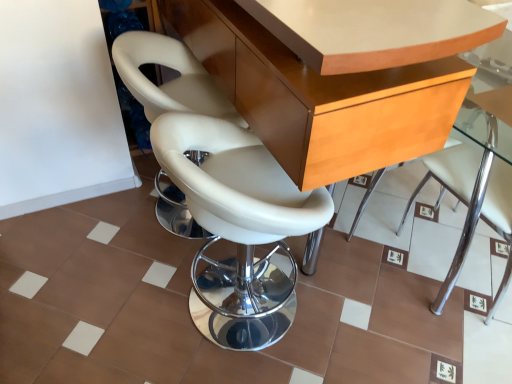
The height and width of the screenshot is (384, 512). Describe the element at coordinates (471, 205) in the screenshot. I see `white leather chair at center, which ranks as the 3th chair in left-to-right order` at that location.

Find the location of a particular element. white leather chair at center, the 2th chair in the left-to-right sequence is located at coordinates (238, 226).

From the image's perspective, is white leather chair at center, which ranks as the 3th chair in right-to-left order, above or below white leather chair at center, which ranks as the 3th chair in left-to-right order?

white leather chair at center, which ranks as the 3th chair in right-to-left order, is above white leather chair at center, which ranks as the 3th chair in left-to-right order.

Visually, is white leather chair at center, which is counted as the first chair, starting from the left, positioned to the left or to the right of white leather chair at center, which ranks as the 3th chair in left-to-right order?

Based on their positions, white leather chair at center, which is counted as the first chair, starting from the left, is located to the left of white leather chair at center, which ranks as the 3th chair in left-to-right order.

Does white leather chair at center, which is counted as the first chair, starting from the left, have a smaller size compared to white leather chair at center, which ranks as the 1th chair in right-to-left order?

Actually, white leather chair at center, which is counted as the first chair, starting from the left, might be larger than white leather chair at center, which ranks as the 1th chair in right-to-left order.

Identify the location of chair that is the 1st object located below the light brown wood table at center (from the image's perspective). The image size is (512, 384). (169, 81).

Which of these two, light brown wood table at center or white leather chair at center, which is counted as the first chair, starting from the left, stands shorter?

With less height is white leather chair at center, which is counted as the first chair, starting from the left.

From the picture: Considering the relative sizes of light brown wood table at center and white leather chair at center, which ranks as the 3th chair in right-to-left order, in the image provided, is light brown wood table at center bigger than white leather chair at center, which ranks as the 3th chair in right-to-left order,?

Correct, light brown wood table at center is larger in size than white leather chair at center, which ranks as the 3th chair in right-to-left order.

From the image's perspective, is light brown wood table at center on white leather chair at center, which ranks as the 3th chair in right-to-left order?

Correct, light brown wood table at center appears higher than white leather chair at center, which ranks as the 3th chair in right-to-left order, in the image.

Which is correct: light brown wood table at center is inside white leather chair at center, arranged as the 2th chair when viewed from the right, or outside of it?

The correct answer is: outside.

Considering the relative positions of light brown wood table at center and white leather chair at center, the 2th chair in the left-to-right sequence, in the image provided, is light brown wood table at center to the right of white leather chair at center, the 2th chair in the left-to-right sequence, from the viewer's perspective?

Indeed, light brown wood table at center is positioned on the right side of white leather chair at center, the 2th chair in the left-to-right sequence.

Which of these two, light brown wood table at center or white leather chair at center, the 2th chair in the left-to-right sequence, stands shorter?

white leather chair at center, the 2th chair in the left-to-right sequence, is shorter.

Is light brown wood table at center aimed at white leather chair at center, the 2th chair in the left-to-right sequence?

No, light brown wood table at center is not facing towards white leather chair at center, the 2th chair in the left-to-right sequence.

Measure the distance between white leather chair at center, arranged as the 2th chair when viewed from the right, and white leather chair at center, which ranks as the 3th chair in left-to-right order.

white leather chair at center, arranged as the 2th chair when viewed from the right, is 33.30 inches away from white leather chair at center, which ranks as the 3th chair in left-to-right order.

Considering the sizes of objects white leather chair at center, arranged as the 2th chair when viewed from the right, and white leather chair at center, which ranks as the 3th chair in left-to-right order, in the image provided, who is shorter, white leather chair at center, arranged as the 2th chair when viewed from the right, or white leather chair at center, which ranks as the 3th chair in left-to-right order,?

With less height is white leather chair at center, arranged as the 2th chair when viewed from the right.

Visually, is white leather chair at center, arranged as the 2th chair when viewed from the right, positioned to the left or to the right of white leather chair at center, which ranks as the 3th chair in left-to-right order?

Based on their positions, white leather chair at center, arranged as the 2th chair when viewed from the right, is located to the left of white leather chair at center, which ranks as the 3th chair in left-to-right order.

Are white leather chair at center, which is counted as the first chair, starting from the left, and white leather chair at center, arranged as the 2th chair when viewed from the right, located far from each other?

No, white leather chair at center, which is counted as the first chair, starting from the left, is in close proximity to white leather chair at center, arranged as the 2th chair when viewed from the right.

Is white leather chair at center, which is counted as the first chair, starting from the left, taller than white leather chair at center, arranged as the 2th chair when viewed from the right?

Incorrect, the height of white leather chair at center, which is counted as the first chair, starting from the left, is not larger of that of white leather chair at center, arranged as the 2th chair when viewed from the right.

Which is closer, (148, 89) or (192, 209)?

Clearly, point (148, 89) is more distant from the camera than point (192, 209).

How much distance is there between white leather chair at center, which is counted as the first chair, starting from the left, and white leather chair at center, the 2th chair in the left-to-right sequence?

white leather chair at center, which is counted as the first chair, starting from the left, is 13.26 inches away from white leather chair at center, the 2th chair in the left-to-right sequence.

Can you see white leather chair at center, the 2th chair in the left-to-right sequence, touching white leather chair at center, which is counted as the first chair, starting from the left?

No, white leather chair at center, the 2th chair in the left-to-right sequence, is not beside white leather chair at center, which is counted as the first chair, starting from the left.

Is white leather chair at center, the 2th chair in the left-to-right sequence, aimed at white leather chair at center, which ranks as the 3th chair in right-to-left order?

No, white leather chair at center, the 2th chair in the left-to-right sequence, is not turned towards white leather chair at center, which ranks as the 3th chair in right-to-left order.

From a real-world perspective, is white leather chair at center, arranged as the 2th chair when viewed from the right, over white leather chair at center, which is counted as the first chair, starting from the left?

Yes, from a real-world perspective, white leather chair at center, arranged as the 2th chair when viewed from the right, is on top of white leather chair at center, which is counted as the first chair, starting from the left.

Considering the positions of point (217, 327) and point (140, 33), is point (217, 327) closer or farther from the camera than point (140, 33)?

Point (217, 327).

Considering the sizes of light brown wood table at center and white leather chair at center, which ranks as the 3th chair in left-to-right order, in the image, is light brown wood table at center wider or thinner than white leather chair at center, which ranks as the 3th chair in left-to-right order,?

light brown wood table at center is wider than white leather chair at center, which ranks as the 3th chair in left-to-right order.

From a real-world perspective, is light brown wood table at center beneath white leather chair at center, which ranks as the 1th chair in right-to-left order?

Incorrect, from a real-world perspective, light brown wood table at center is higher than white leather chair at center, which ranks as the 1th chair in right-to-left order.

Considering the positions of objects light brown wood table at center and white leather chair at center, which ranks as the 1th chair in right-to-left order, in the image provided, who is more to the right, light brown wood table at center or white leather chair at center, which ranks as the 1th chair in right-to-left order,?

Positioned to the right is white leather chair at center, which ranks as the 1th chair in right-to-left order.

Identify the location of chair lying behind the white leather chair at center, which ranks as the 1th chair in right-to-left order. (169, 81).

Where is `table above the white leather chair at center, which ranks as the 3th chair in right-to-left order (from the image's perspective)`? table above the white leather chair at center, which ranks as the 3th chair in right-to-left order (from the image's perspective) is located at coordinates (320, 97).

Considering their positions, is light brown wood table at center positioned further to white leather chair at center, which ranks as the 1th chair in right-to-left order, than white leather chair at center, the 2th chair in the left-to-right sequence?

white leather chair at center, the 2th chair in the left-to-right sequence, is further to white leather chair at center, which ranks as the 1th chair in right-to-left order.

When comparing their distances from white leather chair at center, which ranks as the 3th chair in left-to-right order, does white leather chair at center, arranged as the 2th chair when viewed from the right, or white leather chair at center, which ranks as the 3th chair in right-to-left order, seem closer?

white leather chair at center, arranged as the 2th chair when viewed from the right, is positioned closer to the anchor white leather chair at center, which ranks as the 3th chair in left-to-right order.

Looking at this image, based on their spatial positions, is white leather chair at center, which ranks as the 3th chair in right-to-left order, or white leather chair at center, which ranks as the 1th chair in right-to-left order, further from white leather chair at center, arranged as the 2th chair when viewed from the right?

Among the two, white leather chair at center, which ranks as the 1th chair in right-to-left order, is located further to white leather chair at center, arranged as the 2th chair when viewed from the right.

From the image, which object appears to be nearer to white leather chair at center, the 2th chair in the left-to-right sequence, white leather chair at center, which is counted as the first chair, starting from the left, or light brown wood table at center?

light brown wood table at center.

Looking at the image, which one is located further to white leather chair at center, which ranks as the 1th chair in right-to-left order, white leather chair at center, which is counted as the first chair, starting from the left, or white leather chair at center, arranged as the 2th chair when viewed from the right?

Among the two, white leather chair at center, which is counted as the first chair, starting from the left, is located further to white leather chair at center, which ranks as the 1th chair in right-to-left order.

Looking at this image, based on their spatial positions, is white leather chair at center, arranged as the 2th chair when viewed from the right, or light brown wood table at center closer to white leather chair at center, which is counted as the first chair, starting from the left?

white leather chair at center, arranged as the 2th chair when viewed from the right, is closer to white leather chair at center, which is counted as the first chair, starting from the left.

Which object lies nearer to the anchor point light brown wood table at center, white leather chair at center, which ranks as the 3th chair in left-to-right order, or white leather chair at center, which ranks as the 3th chair in right-to-left order?

The object closer to light brown wood table at center is white leather chair at center, which ranks as the 3th chair in right-to-left order.

Based on their spatial positions, is light brown wood table at center or white leather chair at center, which ranks as the 3th chair in left-to-right order, closer to white leather chair at center, which is counted as the first chair, starting from the left?

light brown wood table at center.

Find the location of `table located between white leather chair at center, which is counted as the first chair, starting from the left, and white leather chair at center, which ranks as the 3th chair in left-to-right order, in the left-right direction`. table located between white leather chair at center, which is counted as the first chair, starting from the left, and white leather chair at center, which ranks as the 3th chair in left-to-right order, in the left-right direction is located at coordinates (320, 97).

Where is `chair between white leather chair at center, which is counted as the first chair, starting from the left, and white leather chair at center, which ranks as the 1th chair in right-to-left order, in the horizontal direction`? The image size is (512, 384). chair between white leather chair at center, which is counted as the first chair, starting from the left, and white leather chair at center, which ranks as the 1th chair in right-to-left order, in the horizontal direction is located at coordinates (238, 226).

Identify the location of table between white leather chair at center, arranged as the 2th chair when viewed from the right, and white leather chair at center, which ranks as the 3th chair in left-to-right order, from left to right. (320, 97).